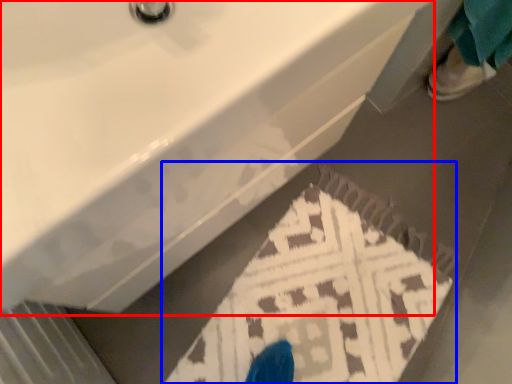
Question: Which object is closer to the camera taking this photo, sink (highlighted by a red box) or doormat (highlighted by a blue box)?

Choices:
 (A) sink
 (B) doormat

Answer: (A)